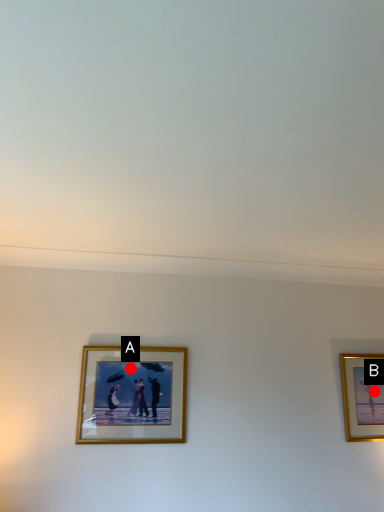
Question: Two points are circled on the image, labeled by A and B beside each circle. Which point is farther to the camera?

Choices:
 (A) A is further
 (B) B is further

Answer: (B)